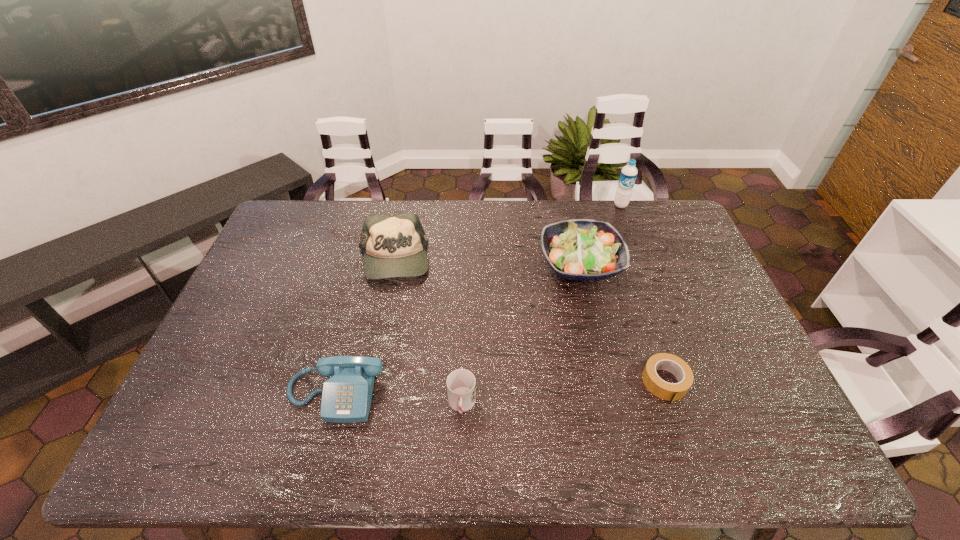
This screenshot has width=960, height=540. What are the coordinates of `vacant area located on the side of the cup where the handle is located` in the screenshot? It's located at (461, 443).

Image resolution: width=960 pixels, height=540 pixels. What are the coordinates of `free spot located 0.150m at the edge of the shortest object` in the screenshot? It's located at (693, 464).

Find the location of a particular element. This screenshot has height=540, width=960. water bottle situated at the far edge is located at coordinates (628, 175).

At what (x,y) coordinates should I click in order to perform the action: click on baseball cap located at the far edge. Please return your answer as a coordinate pair (x, y). The image size is (960, 540). Looking at the image, I should click on (394, 246).

At what (x,y) coordinates should I click in order to perform the action: click on salad plate that is at the far edge. Please return your answer as a coordinate pair (x, y). The height and width of the screenshot is (540, 960). Looking at the image, I should click on (580, 249).

Identify the location of vacant space at the far edge. This screenshot has height=540, width=960. (434, 222).

Image resolution: width=960 pixels, height=540 pixels. Identify the location of vacant space at the near edge of the desktop. (319, 459).

Find the location of a particular element. free space at the left edge of the desktop is located at coordinates (244, 298).

Find the location of `vacant space at the right edge of the desktop`. vacant space at the right edge of the desktop is located at coordinates (735, 396).

Identify the location of free space at the far left corner. This screenshot has width=960, height=540. (309, 212).